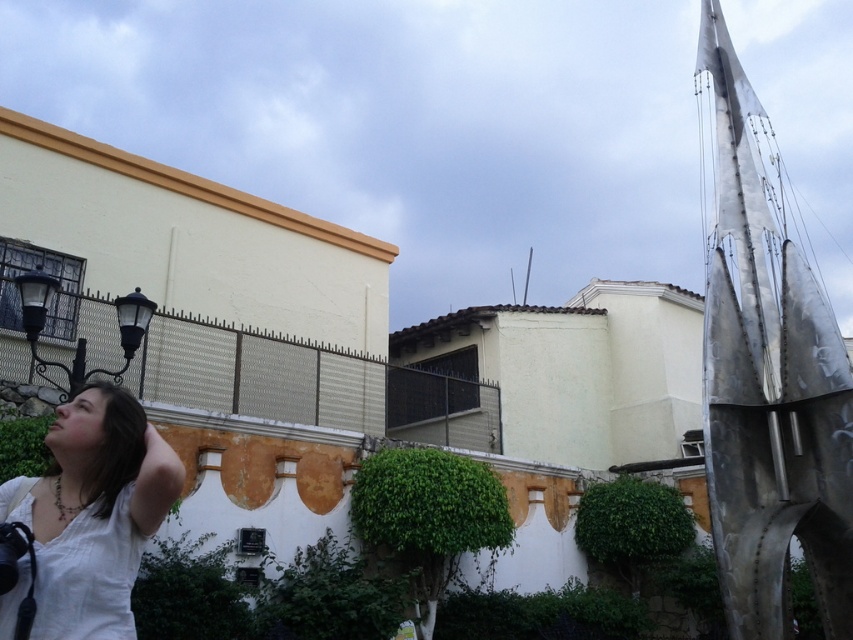
Is metallic silver sculpture at right below white cotton shirt at lower left?

No, metallic silver sculpture at right is not below white cotton shirt at lower left.

What do you see at coordinates (769, 387) in the screenshot?
I see `metallic silver sculpture at right` at bounding box center [769, 387].

Where is `metallic silver sculpture at right`? This screenshot has height=640, width=853. metallic silver sculpture at right is located at coordinates (769, 387).